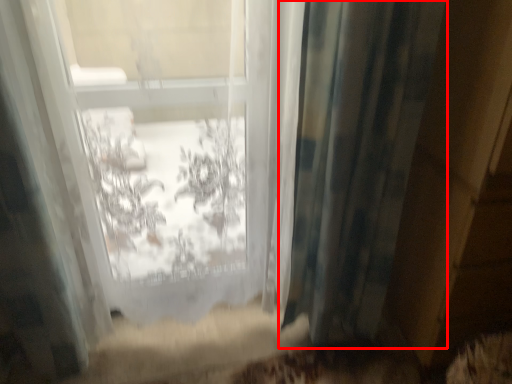
Question: From the image's perspective, considering the relative positions of curtain (annotated by the red box) and bay window in the image provided, where is curtain (annotated by the red box) located with respect to the staircase?

Choices:
 (A) below
 (B) above

Answer: (A)